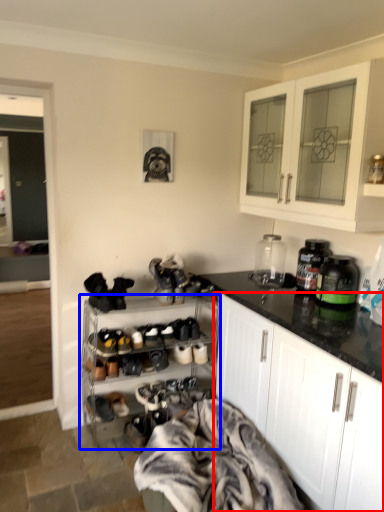
Question: Which object is closer to the camera taking this photo, cabinetry (highlighted by a red box) or shelf (highlighted by a blue box)?

Choices:
 (A) cabinetry
 (B) shelf

Answer: (A)